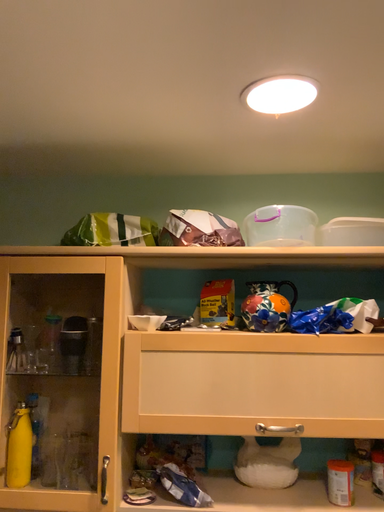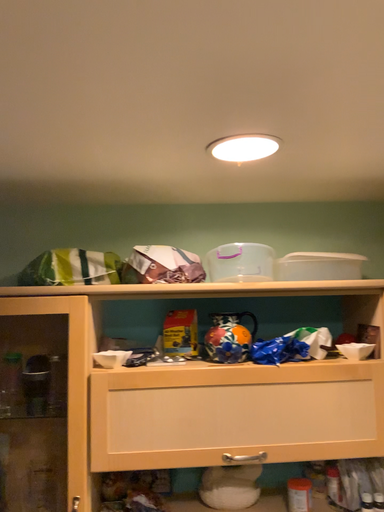
Question: Which way did the camera rotate in the video?

Choices:
 (A) rotated right
 (B) rotated left

Answer: (A)